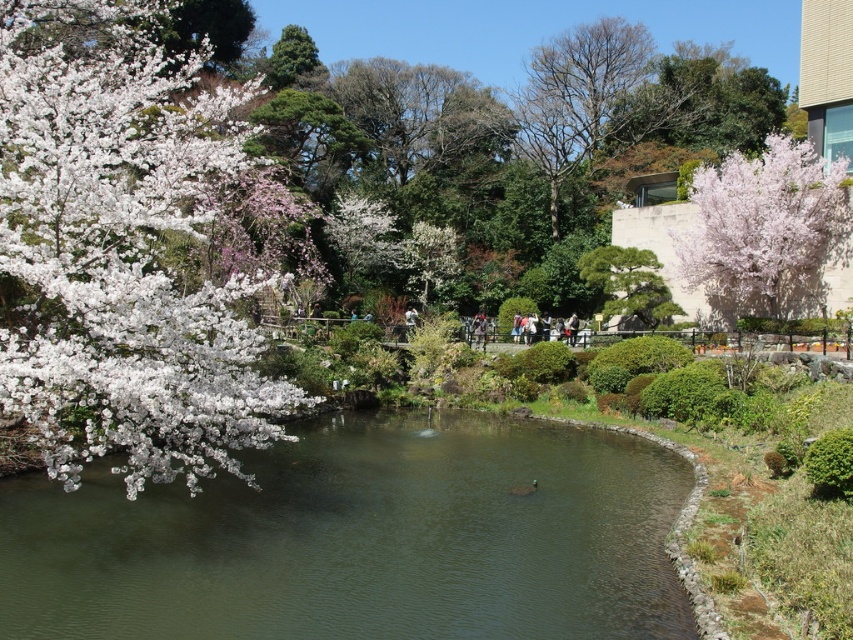
You are planning to place a small decorative boat in the garden scene. The boat requires a water surface wider than the slightly glossy pink blossoms at upper right to float properly. Based on the scene description, can the green smooth water at center accommodate the boat?

The green smooth water at center has a width larger than the slightly glossy pink blossoms at upper right, so yes, the boat can be placed there as it meets the required width.

You are planning to place a small wooden boat in the garden scene. The boat is 2 meters long. You see the green smooth water at center and the white matte blossoms at left. Which location would allow the boat to fit without overlapping the blossoms?

The green smooth water at center has a width less than the white matte blossoms at left, so the boat may not fit there. The white matte blossoms at left are wider, so placing the boat there might be possible if the blossoms are not obstructing the water surface.

You are a gardener observing the garden scene. You notice the green smooth water at center and the white matte blossoms at left. Which object is lower in height?

The green smooth water at center has a lesser height compared to white matte blossoms at left, so the green smooth water at center is lower in height.